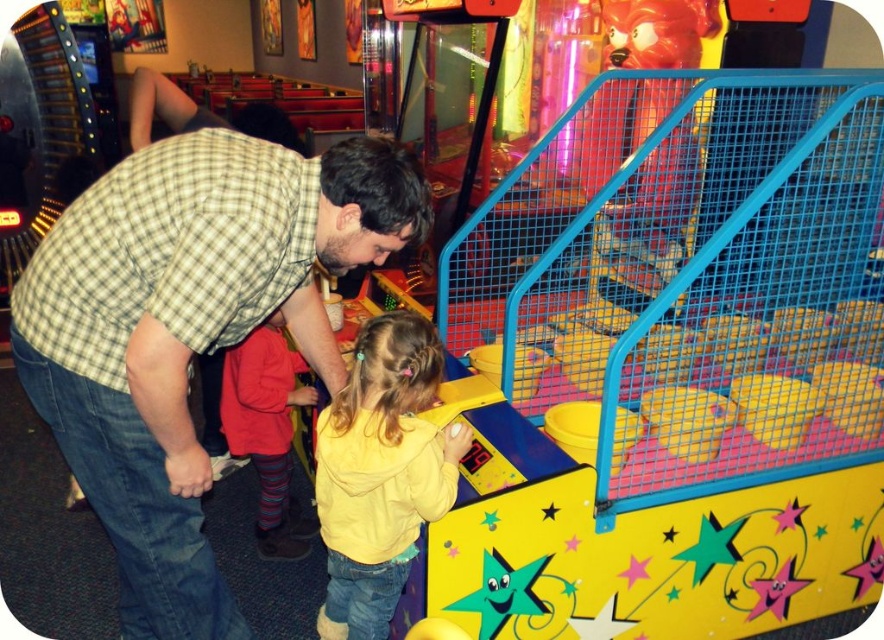
Who is lower down, checkered fabric shirt at center or yellow fleece jacket at center?

yellow fleece jacket at center

This screenshot has height=640, width=884. In order to click on checkered fabric shirt at center in this screenshot , I will do `click(189, 330)`.

Is checkered fabric shirt at center above red knit sweater at lower left?

Indeed, checkered fabric shirt at center is positioned over red knit sweater at lower left.

Does checkered fabric shirt at center come in front of red knit sweater at lower left?

That is True.

Does point (340, 188) come behind point (284, 339)?

No, it is not.

I want to click on checkered fabric shirt at center, so click(189, 330).

Is yellow fleece jacket at center to the right of red knit sweater at lower left from the viewer's perspective?

Yes, yellow fleece jacket at center is to the right of red knit sweater at lower left.

Between yellow fleece jacket at center and red knit sweater at lower left, which one appears on the right side from the viewer's perspective?

yellow fleece jacket at center is more to the right.

Is point (328, 435) less distant than point (264, 413)?

That is True.

Where is `yellow fleece jacket at center`? This screenshot has height=640, width=884. yellow fleece jacket at center is located at coordinates (380, 472).